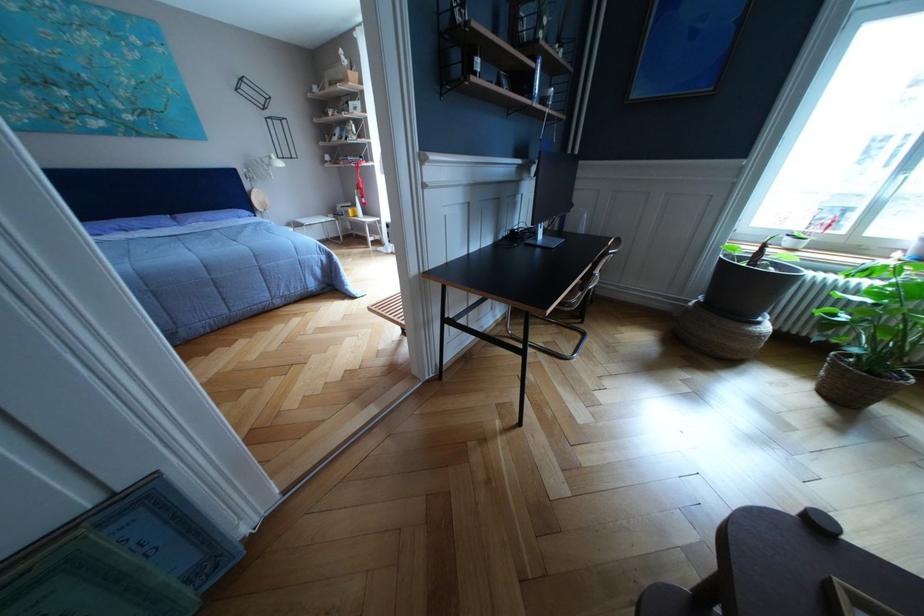
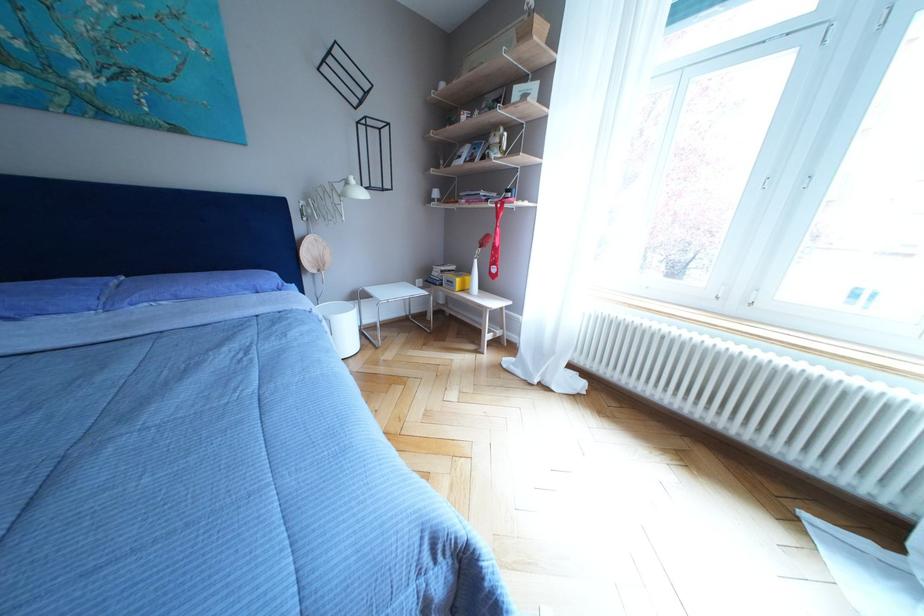
In the second image, find the point that corresponds to (x=256, y=172) in the first image.

(315, 203)